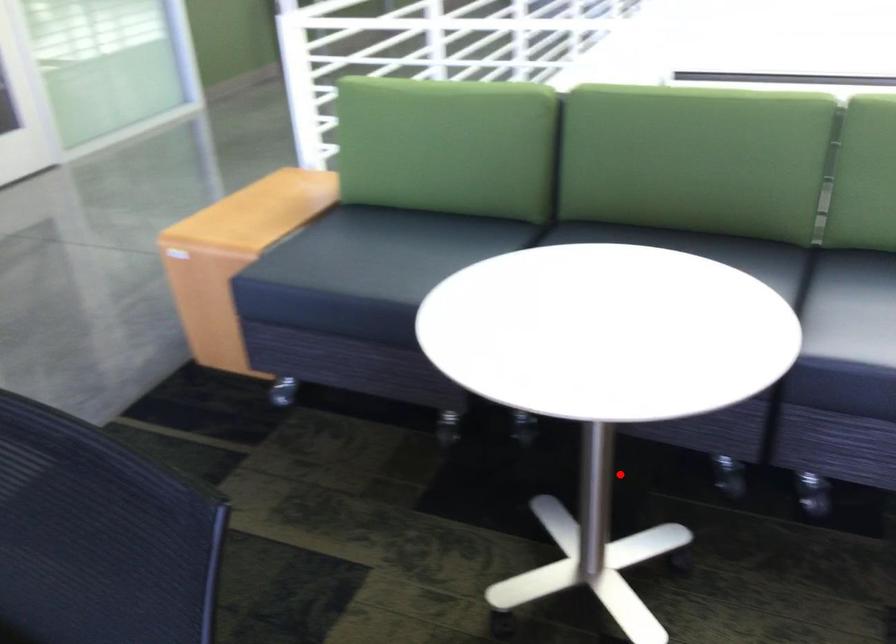
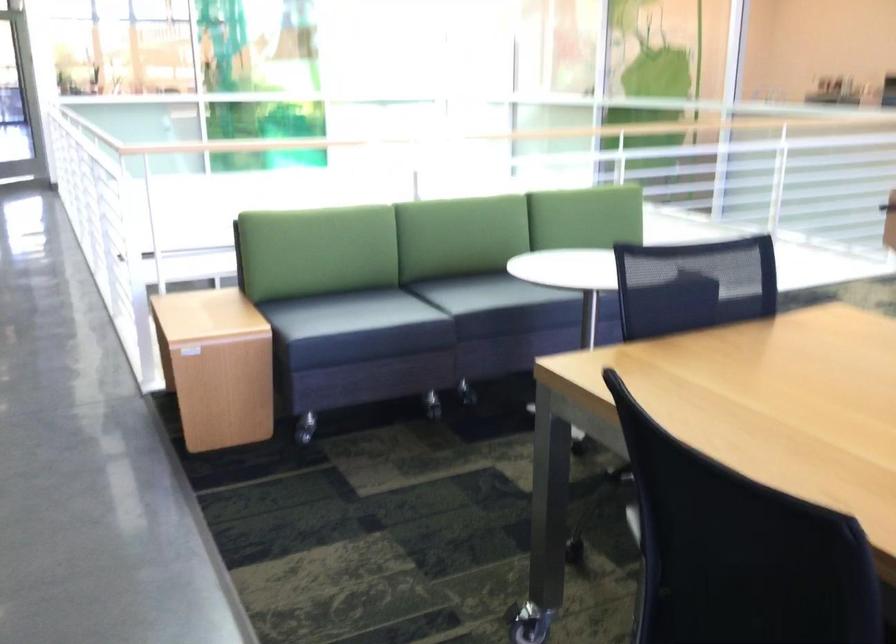
Question: A red point is marked in image1. In image2, is the corresponding 3D point closer to the camera or farther? Reply with the corresponding letter.

Choices:
 (A) The corresponding 3D point is closer.
 (B) The corresponding 3D point is farther.

Answer: (B)